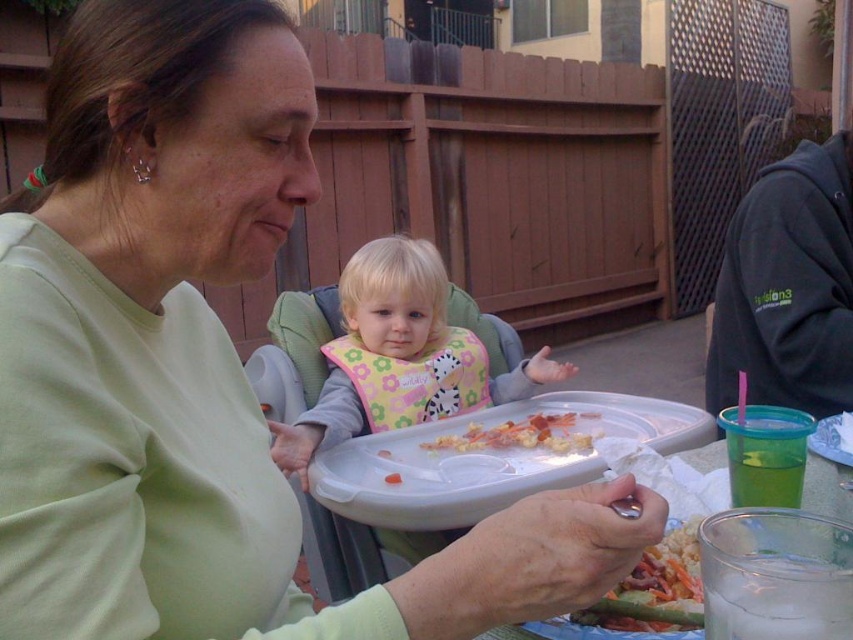
Question: Which of the following is the farthest from the observer?

Choices:
 (A) floral fabric bib at center
 (B) crumbly bread at center
 (C) white plastic tray at center
 (D) pink fabric bib at center

Answer: (A)

Question: Is white plastic tray at center below shiny plastic fork at lower center?

Choices:
 (A) no
 (B) yes

Answer: (B)

Question: Estimate the real-world distances between objects in this image. Which object is farther from the white plastic tray at center?

Choices:
 (A) floral fabric bib at center
 (B) pink fabric bib at center
 (C) crumbly bread at center

Answer: (A)

Question: Which object is closer to the camera taking this photo?

Choices:
 (A) pink fabric bib at center
 (B) shiny plastic fork at lower center
 (C) crumbly bread at center
 (D) floral fabric bib at center

Answer: (B)

Question: In this image, where is white plastic tray at center located relative to shiny plastic fork at lower center?

Choices:
 (A) below
 (B) above

Answer: (A)

Question: Is pink fabric bib at center positioned behind crumbly bread at center?

Choices:
 (A) no
 (B) yes

Answer: (A)